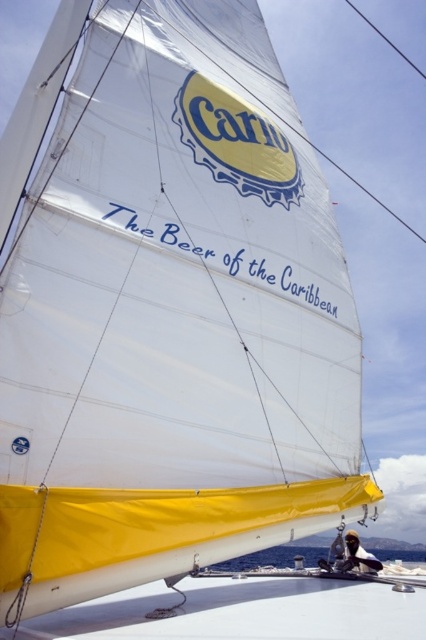
Does transparent water at lower center appear under smooth black hair at lower right?

Indeed, transparent water at lower center is positioned under smooth black hair at lower right.

Which of these two, transparent water at lower center or smooth black hair at lower right, stands taller?

transparent water at lower center is taller.

Who is more forward, (290, 548) or (363, 564)?

Point (363, 564) is in front.

You are a GUI agent. You are given a task and a screenshot of the screen. Output one action in this format:
    pyautogui.click(x=<x>, y=<y>)
    Task: Click on the transparent water at lower center
    Image resolution: width=426 pixels, height=640 pixels.
    Given the screenshot: What is the action you would take?
    pyautogui.click(x=273, y=557)